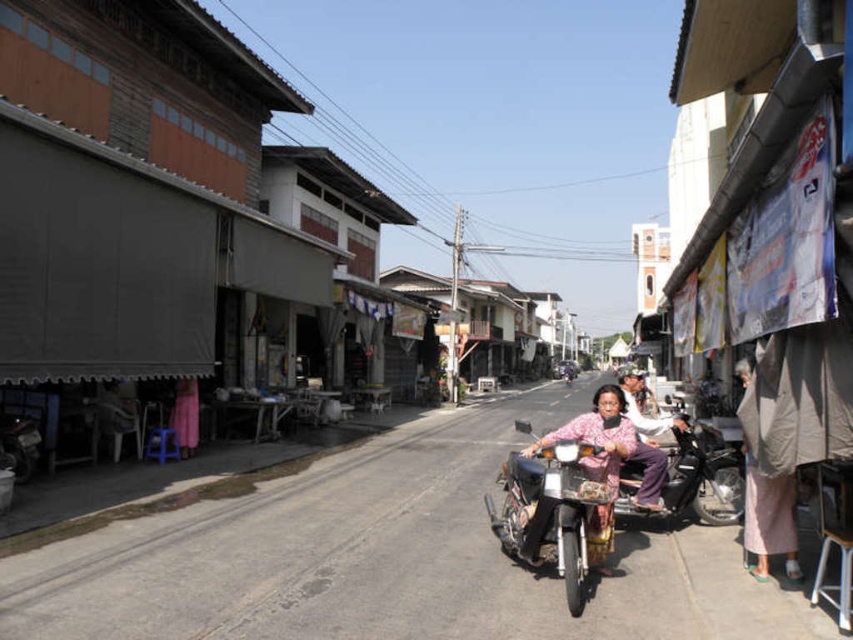
Question: Which point is closer to the camera?

Choices:
 (A) metallic silver motorcycle at center
 (B) matte black motorcycle at center

Answer: (B)

Question: Observing the image, what is the correct spatial positioning of matte black motorcycle at center in reference to matte pink pants at center?

Choices:
 (A) left
 (B) right

Answer: (A)

Question: Does metallic silver motorcycle at center have a larger size compared to matte pink pants at center?

Choices:
 (A) yes
 (B) no

Answer: (B)

Question: Does matte black motorcycle at center come in front of matte pink pants at center?

Choices:
 (A) no
 (B) yes

Answer: (B)

Question: Which point is farther from the camera taking this photo?

Choices:
 (A) (421, 532)
 (B) (566, 595)
 (C) (653, 417)

Answer: (C)

Question: Which of the following is the closest to the observer?

Choices:
 (A) (646, 424)
 (B) (376, 593)
 (C) (529, 492)

Answer: (B)